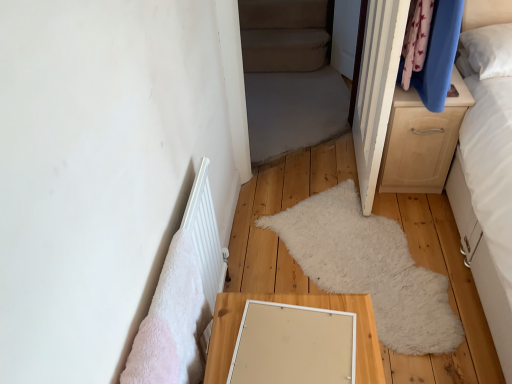
Question: Does beige fabric bed at center have a lesser height compared to light wood/texture chest of drawers at right?

Choices:
 (A) yes
 (B) no

Answer: (B)

Question: From the image's perspective, is beige fabric bed at center located beneath light wood/texture chest of drawers at right?

Choices:
 (A) yes
 (B) no

Answer: (B)

Question: Can you confirm if beige fabric bed at center is positioned to the left of light wood/texture chest of drawers at right?

Choices:
 (A) no
 (B) yes

Answer: (B)

Question: From the image's perspective, is beige fabric bed at center above light wood/texture chest of drawers at right?

Choices:
 (A) no
 (B) yes

Answer: (B)

Question: Is beige fabric bed at center thinner than light wood/texture chest of drawers at right?

Choices:
 (A) yes
 (B) no

Answer: (A)

Question: From the image's perspective, is light wood/texture table at lower center located above or below white matte radiator at lower left?

Choices:
 (A) above
 (B) below

Answer: (B)

Question: Considering the positions of light wood/texture table at lower center and white matte radiator at lower left in the image, is light wood/texture table at lower center taller or shorter than white matte radiator at lower left?

Choices:
 (A) tall
 (B) short

Answer: (A)

Question: Considering the positions of light wood/texture table at lower center and white matte radiator at lower left in the image, is light wood/texture table at lower center wider or thinner than white matte radiator at lower left?

Choices:
 (A) thin
 (B) wide

Answer: (B)

Question: Is light wood/texture table at lower center inside or outside of white matte radiator at lower left?

Choices:
 (A) inside
 (B) outside

Answer: (B)

Question: From a real-world perspective, relative to beige fabric bed at center, is white matte radiator at lower left vertically above or below?

Choices:
 (A) above
 (B) below

Answer: (B)

Question: From their relative heights in the image, would you say white matte radiator at lower left is taller or shorter than beige fabric bed at center?

Choices:
 (A) short
 (B) tall

Answer: (A)

Question: Which is correct: white matte radiator at lower left is inside beige fabric bed at center, or outside of it?

Choices:
 (A) outside
 (B) inside

Answer: (A)

Question: Considering the positions of white matte radiator at lower left and beige fabric bed at center in the image, is white matte radiator at lower left wider or thinner than beige fabric bed at center?

Choices:
 (A) wide
 (B) thin

Answer: (B)

Question: Is wooden floor mat at center wider or thinner than light wood/texture chest of drawers at right?

Choices:
 (A) wide
 (B) thin

Answer: (A)

Question: In the image, is wooden floor mat at center on the left side or the right side of light wood/texture chest of drawers at right?

Choices:
 (A) left
 (B) right

Answer: (A)